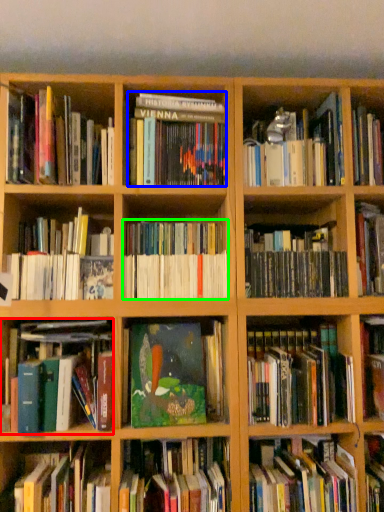
Question: Considering the real-world distances, which object is closest to book (highlighted by a red box)? book (highlighted by a blue box) or book (highlighted by a green box).

Choices:
 (A) book
 (B) book

Answer: (B)